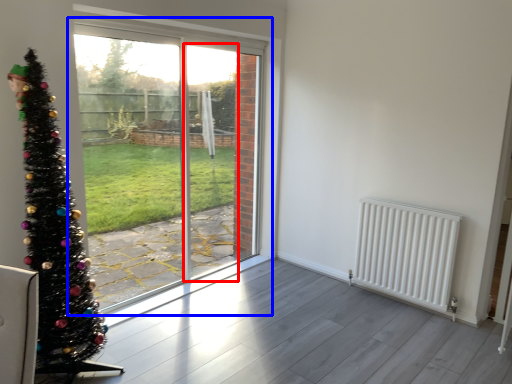
Question: Which object is further to the camera taking this photo, screen door (highlighted by a red box) or window (highlighted by a blue box)?

Choices:
 (A) screen door
 (B) window

Answer: (A)